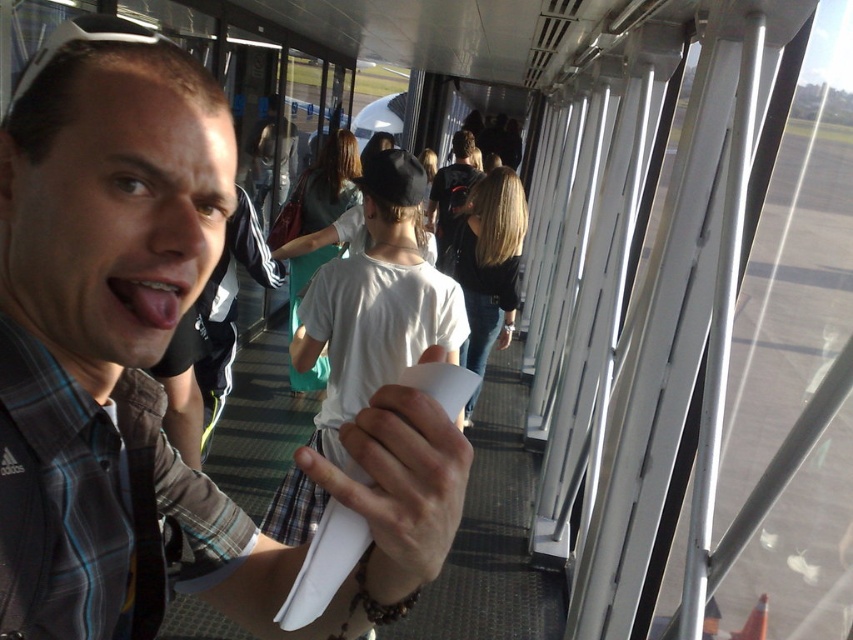
You are standing in the airport jet bridge and see the man with the white matte shirt at center. Where exactly is he located in the jet bridge?

The white matte shirt at center is located at point (376, 301) in the jet bridge.

You are standing in the airport jet bridge and see the man with the plaid shirt and sunglasses on top of his head. There is a point at coordinates (376, 301). Can you tell me what object this point is located on?

The point at coordinates (376, 301) is located on the white matte shirt at center.

You are an airport staff member standing at the entrance of the jet bridge. You notice two items at the center of the scene. Which item is closer to the left side of the jet bridge? The two items are the white matte shirt at center and the white paper at center.

The white matte shirt at center is to the left of the white paper at center, so the white matte shirt at center is closer to the left side of the jet bridge.